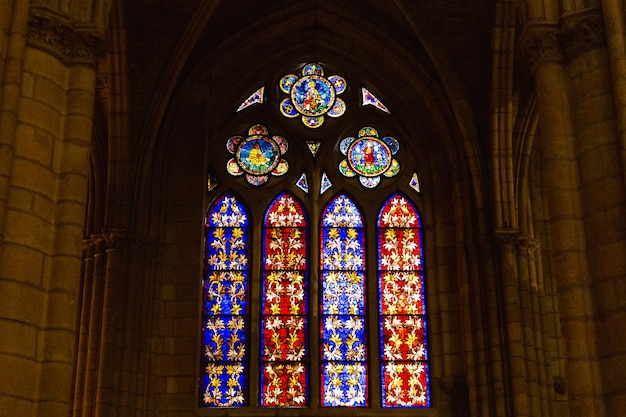
You are a GUI agent. You are given a task and a screenshot of the screen. Output one action in this format:
    pyautogui.click(x=<x>, y=<y>)
    Task: Click on the red long window sections
    Image resolution: width=626 pixels, height=417 pixels.
    Given the screenshot: What is the action you would take?
    pyautogui.click(x=401, y=210), pyautogui.click(x=404, y=245), pyautogui.click(x=398, y=289), pyautogui.click(x=404, y=348), pyautogui.click(x=404, y=377), pyautogui.click(x=275, y=386), pyautogui.click(x=280, y=336), pyautogui.click(x=280, y=303), pyautogui.click(x=287, y=257), pyautogui.click(x=285, y=205)